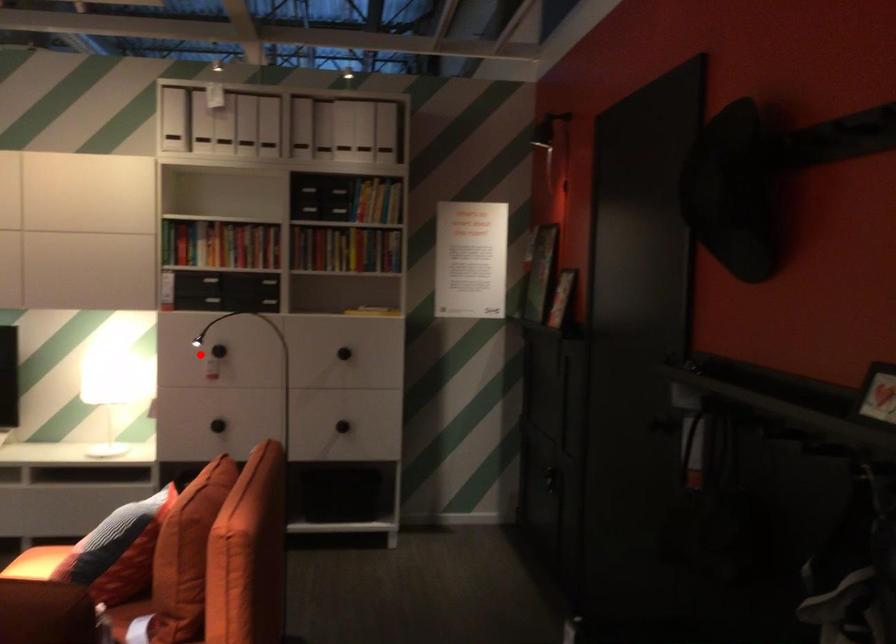
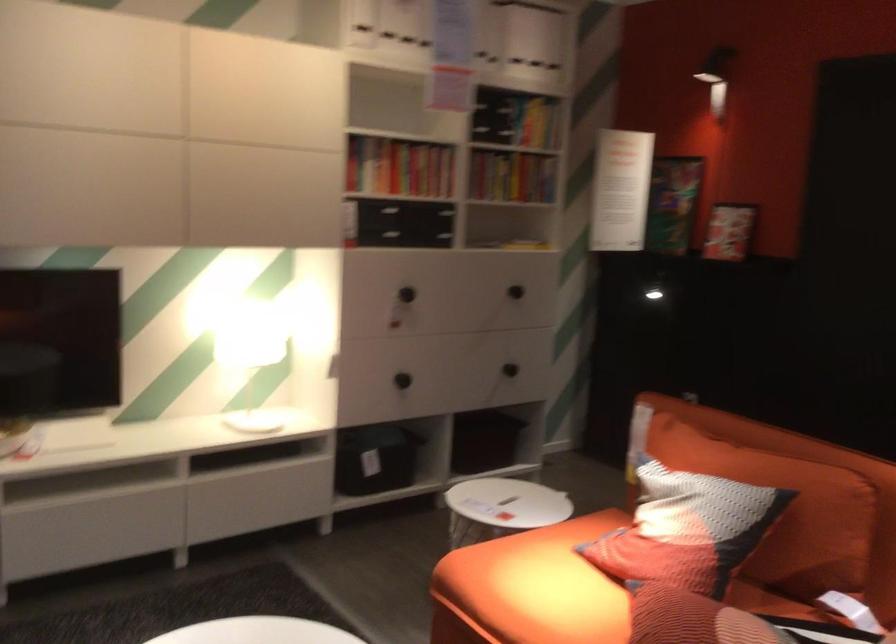
Question: I am providing you with two images of the same scene from different viewpoints. Image1 has a red point marked. In image2, the corresponding 3D location appears at what relative position? Reply with the corresponding letter.

Choices:
 (A) Closer
 (B) Farther

Answer: (A)